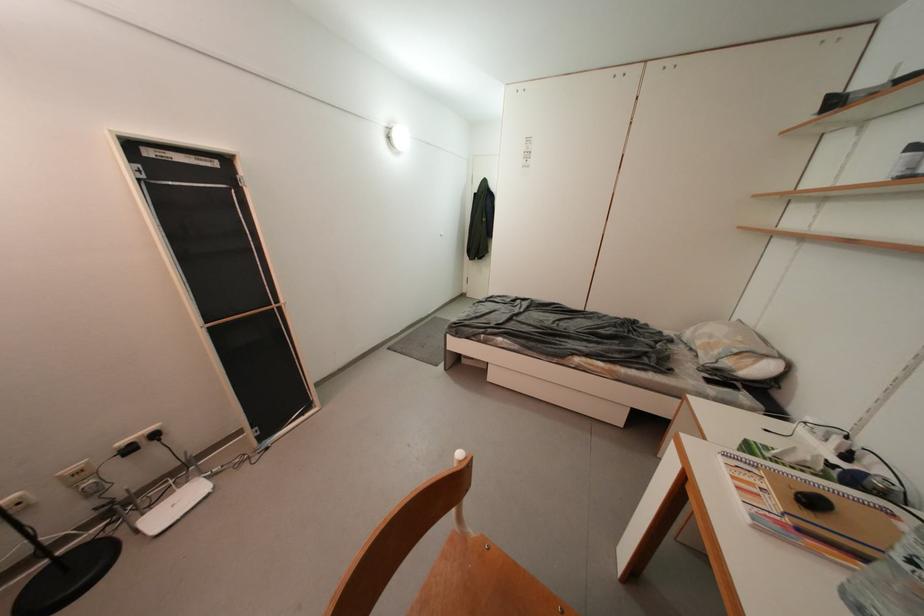
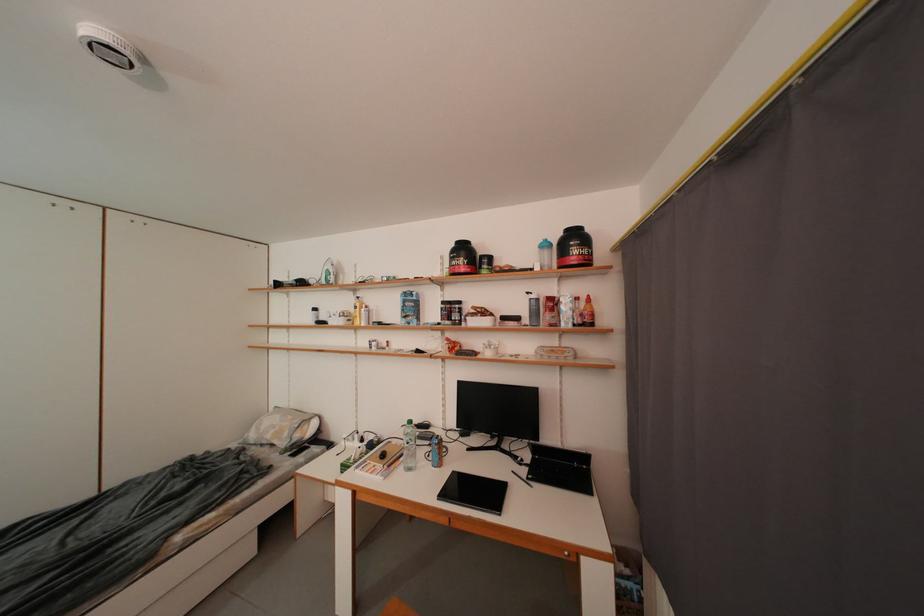
Find the pixel in the second image that matches pixel 821 506 in the first image.

(391, 459)